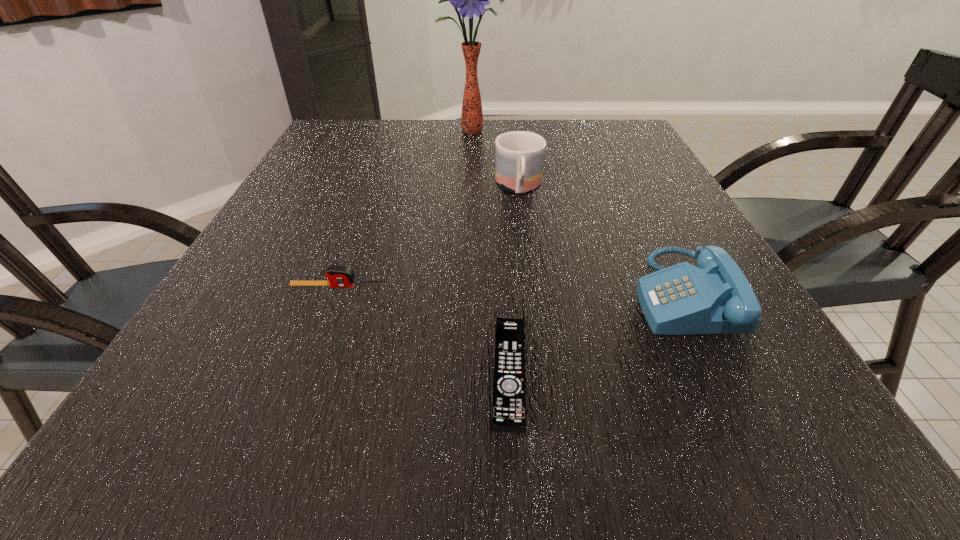
You are a GUI agent. You are given a task and a screenshot of the screen. Output one action in this format:
    pyautogui.click(x=<x>, y=<y>)
    Task: Click on the flower arrangement
    The image size is (960, 540).
    Given the screenshot: What is the action you would take?
    pyautogui.click(x=471, y=0)

Locate an element on the screen. the farthest object is located at coordinates (471, 0).

The height and width of the screenshot is (540, 960). What are the coordinates of `the fourth nearest object` in the screenshot? It's located at (519, 155).

Find the location of a particular element. the rightmost object is located at coordinates (715, 297).

This screenshot has width=960, height=540. In order to click on telephone in this screenshot , I will do `click(715, 297)`.

This screenshot has height=540, width=960. Identify the location of the second shortest object. (339, 276).

Locate an element on the screen. tape measure is located at coordinates (339, 276).

The height and width of the screenshot is (540, 960). Find the location of `the shortest object`. the shortest object is located at coordinates (509, 391).

Image resolution: width=960 pixels, height=540 pixels. I want to click on vacant space located 0.370m on the right of the flower arrangement, so click(628, 131).

Where is `blank area located 0.400m on the side with the handle of the fourth nearest object`? blank area located 0.400m on the side with the handle of the fourth nearest object is located at coordinates (540, 344).